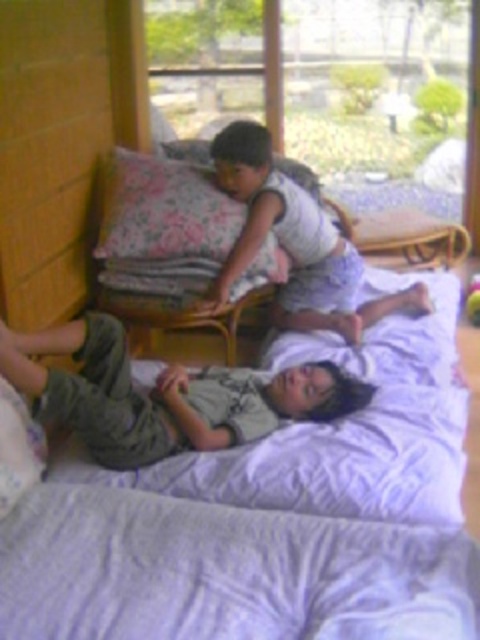
You are a photographer taking a picture of the two children on the bed. You need to adjust the camera focus so that both the green cotton pants at lower center and the white cotton shirt at upper center are in focus. Which direction should you move the focus point to ensure both are sharp?

Move the focus point to the left of white cotton shirt at upper center so that it aligns with the green cotton pants at lower center, ensuring both are in focus.

You are a parent trying to reach the white cotton shirt at upper center from the white soft bed at lower center to give it to your child. Can you comfortably stretch and grab it without getting out of the bed?

The white soft bed at lower center and white cotton shirt at upper center are 56.22 centimeters apart, so yes, you can comfortably stretch and grab the white cotton shirt at upper center from the bed without getting out.